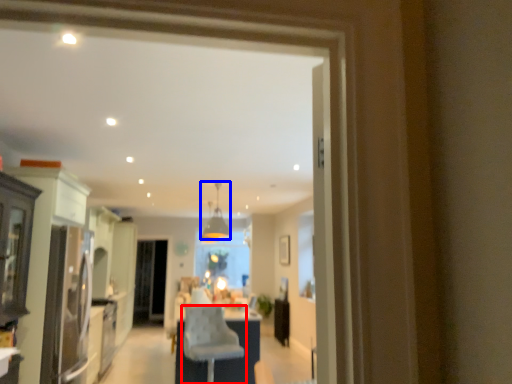
Question: Which of the following is the farthest to the observer, chair (highlighted by a red box) or light fixture (highlighted by a blue box)?

Choices:
 (A) chair
 (B) light fixture

Answer: (B)